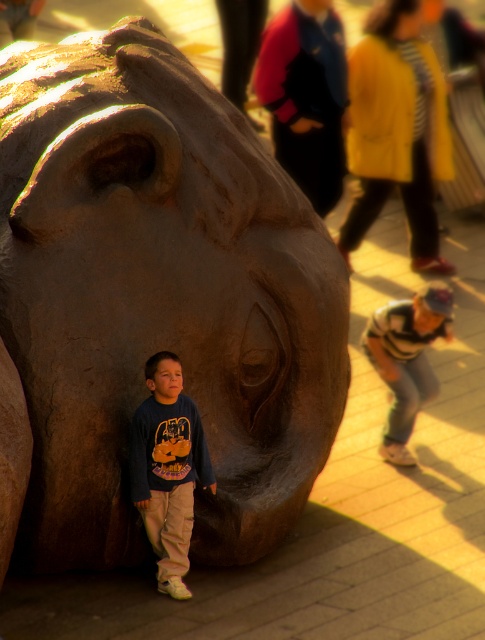
Question: Which object is positioned farthest from the bronze statue at lower left?

Choices:
 (A) dark blue sweatshirt at lower left
 (B) striped sweater at lower right

Answer: (B)

Question: Which object is closer to the camera taking this photo?

Choices:
 (A) dark blue sweatshirt at lower left
 (B) striped sweater at lower right
 (C) bronze statue at lower left

Answer: (C)

Question: Does bronze statue at lower left appear on the left side of dark blue sweatshirt at lower left?

Choices:
 (A) yes
 (B) no

Answer: (A)

Question: Is dark blue sweatshirt at lower left wider than striped sweater at lower right?

Choices:
 (A) no
 (B) yes

Answer: (A)

Question: Is bronze statue at lower left wider than striped sweater at lower right?

Choices:
 (A) yes
 (B) no

Answer: (A)

Question: Which of the following is the closest to the observer?

Choices:
 (A) striped sweater at lower right
 (B) bronze statue at lower left

Answer: (B)